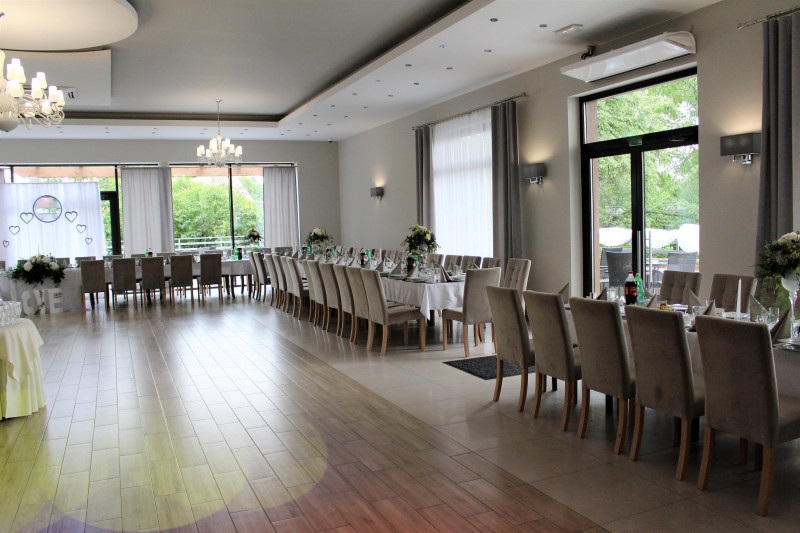
Locate an element on the screen. The height and width of the screenshot is (533, 800). table is located at coordinates (6, 353), (229, 261), (426, 297), (782, 366).